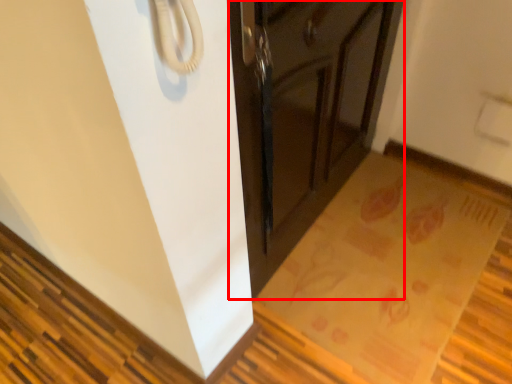
Question: From the image's perspective, where is cabinetry (annotated by the red box) located in relation to mat in the image?

Choices:
 (A) above
 (B) below

Answer: (A)